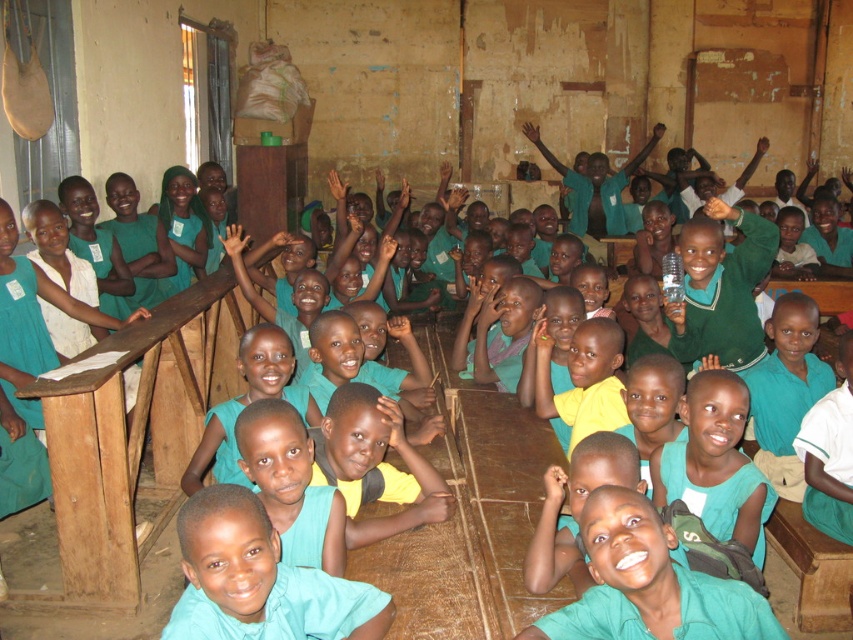
Between green matte sweater at center and matte green shirt at center, which one has more height?

Standing taller between the two is green matte sweater at center.

Is green matte sweater at center thinner than matte green shirt at center?

No, green matte sweater at center is not thinner than matte green shirt at center.

Does point (718, 356) lie in front of point (328, 525)?

No, (718, 356) is further to viewer.

Find the location of a particular element. green matte sweater at center is located at coordinates (721, 288).

Based on the photo, who is higher up, teal matte shirt at center or dark brown wood hand at lower center?

dark brown wood hand at lower center

Between teal matte shirt at center and dark brown wood hand at lower center, which one appears on the right side from the viewer's perspective?

dark brown wood hand at lower center is more to the right.

The width and height of the screenshot is (853, 640). I want to click on teal matte shirt at center, so click(x=260, y=580).

Does matte green shirt at center appear under dark skin hand at lower center?

No.

What are the coordinates of `matte green shirt at center` in the screenshot? It's located at (291, 484).

Image resolution: width=853 pixels, height=640 pixels. In order to click on matte green shirt at center in this screenshot , I will do coord(291,484).

Locate an element on the screen. The height and width of the screenshot is (640, 853). matte green shirt at center is located at coordinates (291, 484).